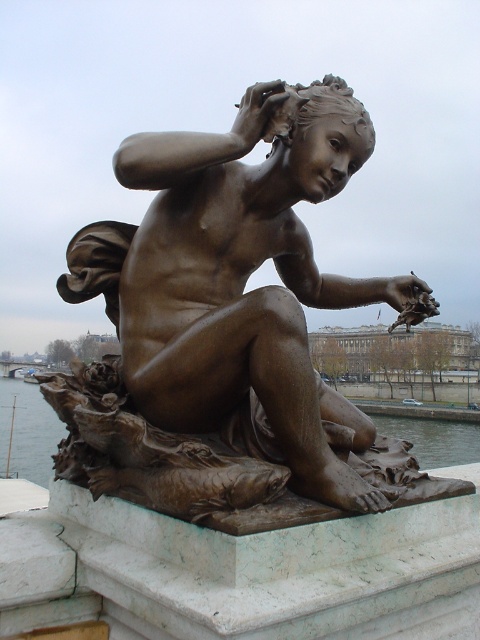
Question: Does bronze statue at center appear on the right side of clear water at statue center?

Choices:
 (A) no
 (B) yes

Answer: (B)

Question: Where is bronze statue at center located in relation to clear water at statue center in the image?

Choices:
 (A) above
 (B) below

Answer: (A)

Question: Is bronze statue at center smaller than clear water at statue center?

Choices:
 (A) no
 (B) yes

Answer: (B)

Question: Which point is closer to the camera?

Choices:
 (A) (381, 428)
 (B) (295, 244)

Answer: (B)